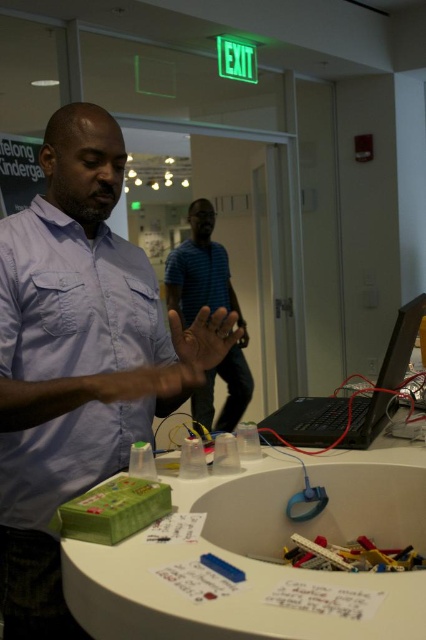
You are an observer in the room and you need to locate the matte blue shirt at left and the black matte laptop at right. Which object is closer to the left edge of the room?

The matte blue shirt at left is closer to the left edge of the room because it is positioned on the left side of the black matte laptop at right.

You are an observer standing in front of the workspace. There is a point at coordinate (77, 358). What object is located at that point?

The point at coordinate (77, 358) indicates the matte blue shirt at center.